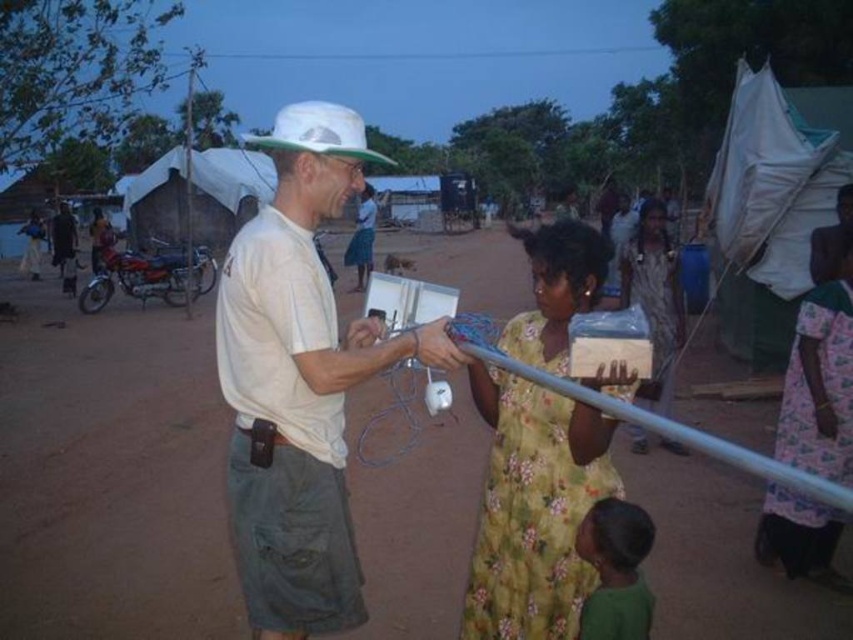
Does brown dirt field at center have a lesser width compared to yellow floral dress at center?

No, brown dirt field at center is not thinner than yellow floral dress at center.

At what (x,y) coordinates should I click in order to perform the action: click on brown dirt field at center. Please return your answer as a coordinate pair (x, y). Looking at the image, I should click on (111, 476).

Identify the location of brown dirt field at center. (111, 476).

Is brown dirt field at center bigger than floral print dress at center?

Yes.

Is brown dirt field at center to the right of floral print dress at center from the viewer's perspective?

In fact, brown dirt field at center is to the left of floral print dress at center.

Find the location of a particular element. Image resolution: width=853 pixels, height=640 pixels. brown dirt field at center is located at coordinates (111, 476).

Who is shorter, white matte hat at center or green matte shirt at lower center?

With less height is green matte shirt at lower center.

Which is below, white matte hat at center or green matte shirt at lower center?

green matte shirt at lower center is lower down.

Is point (289, 355) closer to camera compared to point (637, 518)?

That is True.

Locate an element on the screen. The image size is (853, 640). white matte hat at center is located at coordinates (299, 381).